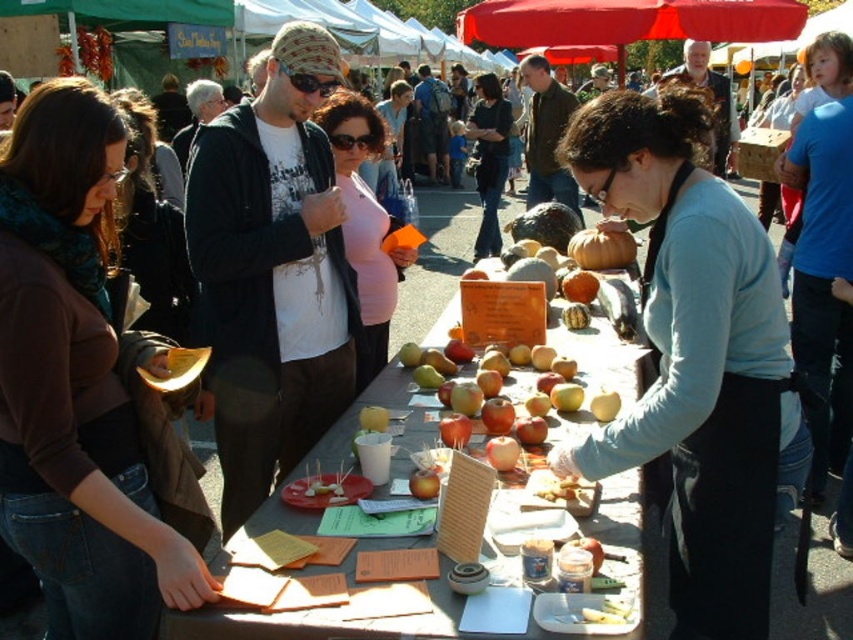
Who is taller, light blue fabric apron at center or matte wooden table at center?

Standing taller between the two is light blue fabric apron at center.

Identify the location of light blue fabric apron at center. The width and height of the screenshot is (853, 640). (695, 358).

What are the coordinates of `light blue fabric apron at center` in the screenshot? It's located at 695,358.

Does brown fabric scarf at upper left have a smaller size compared to orange matte pumpkin at center?

No.

This screenshot has width=853, height=640. What do you see at coordinates (74, 384) in the screenshot?
I see `brown fabric scarf at upper left` at bounding box center [74, 384].

At what (x,y) coordinates should I click in order to perform the action: click on brown fabric scarf at upper left. Please return your answer as a coordinate pair (x, y). This screenshot has height=640, width=853. Looking at the image, I should click on (74, 384).

Between light blue fabric apron at center and orange matte pumpkin at center, which one has more height?

With more height is light blue fabric apron at center.

In the scene shown: Can you confirm if light blue fabric apron at center is smaller than orange matte pumpkin at center?

Incorrect, light blue fabric apron at center is not smaller in size than orange matte pumpkin at center.

Image resolution: width=853 pixels, height=640 pixels. I want to click on light blue fabric apron at center, so click(x=695, y=358).